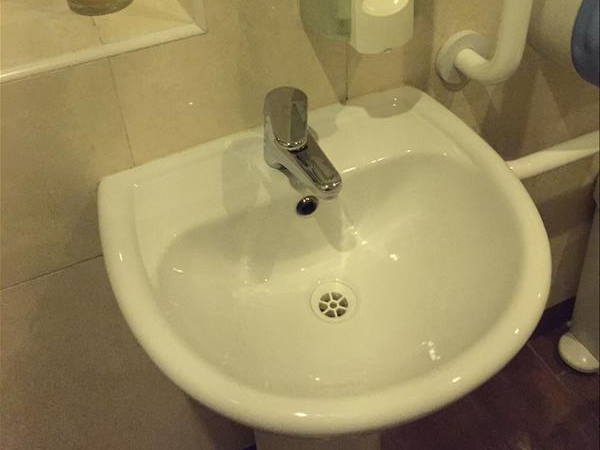
Where is `wall`? The height and width of the screenshot is (450, 600). wall is located at coordinates (78, 132).